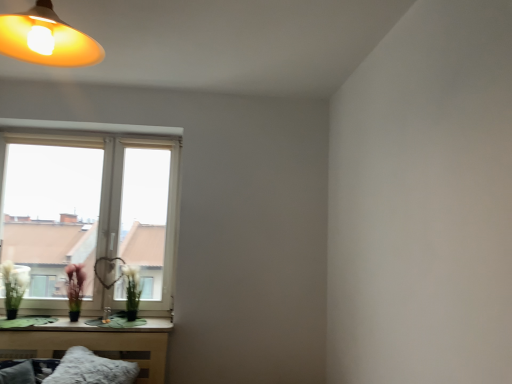
Question: Is green matte plant at window, arranged as the 2th flower when viewed from the left, positioned far away from fuzzy white pillow at lower left?

Choices:
 (A) no
 (B) yes

Answer: (A)

Question: Is green matte plant at window, placed as the 1th flower when sorted from right to left, wider than fuzzy white pillow at lower left?

Choices:
 (A) yes
 (B) no

Answer: (B)

Question: From the image's perspective, is green matte plant at window, placed as the 1th flower when sorted from right to left, located beneath fuzzy white pillow at lower left?

Choices:
 (A) no
 (B) yes

Answer: (A)

Question: Can you confirm if green matte plant at window, arranged as the 2th flower when viewed from the left, is positioned to the left of fuzzy white pillow at lower left?

Choices:
 (A) no
 (B) yes

Answer: (A)

Question: Are green matte plant at window, placed as the 1th flower when sorted from right to left, and fuzzy white pillow at lower left beside each other?

Choices:
 (A) no
 (B) yes

Answer: (A)

Question: From a real-world perspective, is green matte flower at lower left, acting as the 1th flower starting from the left, above or below white plastic window at lower left?

Choices:
 (A) below
 (B) above

Answer: (A)

Question: From the image's perspective, is green matte flower at lower left, acting as the 1th flower starting from the left, positioned above or below white plastic window at lower left?

Choices:
 (A) above
 (B) below

Answer: (B)

Question: Which is correct: green matte flower at lower left, which is the 2th flower from right to left, is inside white plastic window at lower left, or outside of it?

Choices:
 (A) inside
 (B) outside

Answer: (B)

Question: Looking at the image, does green matte flower at lower left, which is the 2th flower from right to left, seem bigger or smaller compared to white plastic window at lower left?

Choices:
 (A) big
 (B) small

Answer: (B)

Question: In terms of height, does green matte plant at window, arranged as the 2th flower when viewed from the left, look taller or shorter compared to green matte flower at lower left, which is the 2th flower from right to left?

Choices:
 (A) tall
 (B) short

Answer: (B)

Question: Is green matte plant at window, placed as the 1th flower when sorted from right to left, in front of or behind green matte flower at lower left, acting as the 1th flower starting from the left, in the image?

Choices:
 (A) front
 (B) behind

Answer: (B)

Question: Looking at the image, does green matte plant at window, placed as the 1th flower when sorted from right to left, seem bigger or smaller compared to green matte flower at lower left, acting as the 1th flower starting from the left?

Choices:
 (A) big
 (B) small

Answer: (B)

Question: Would you say green matte plant at window, arranged as the 2th flower when viewed from the left, is to the left or to the right of green matte flower at lower left, acting as the 1th flower starting from the left, in the picture?

Choices:
 (A) right
 (B) left

Answer: (A)

Question: Is green matte vase at lower left to the left or to the right of green matte flower at lower left, which is the 2th flower from right to left, in the image?

Choices:
 (A) left
 (B) right

Answer: (A)

Question: From the image's perspective, is green matte vase at lower left positioned above or below green matte flower at lower left, which is the 2th flower from right to left?

Choices:
 (A) above
 (B) below

Answer: (A)